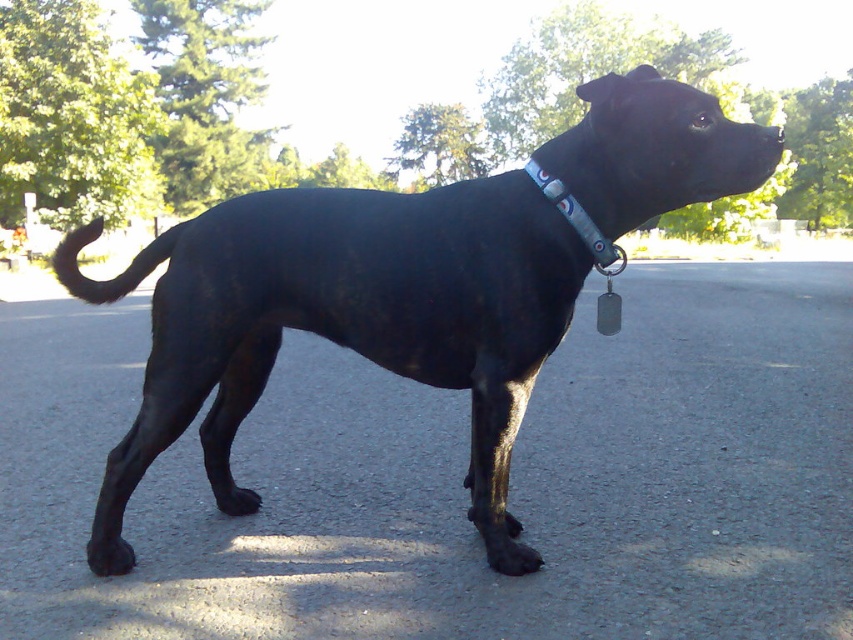
You are a photographer trying to capture the black smooth dog at center and the blue fabric collar at upper center in the same frame. Based on their positions, which object should you adjust your camera to focus on first to ensure both are in the frame?

The black smooth dog at center is to the left of the blue fabric collar at upper center, so you should focus on the blue fabric collar at upper center first to ensure both are captured in the frame.